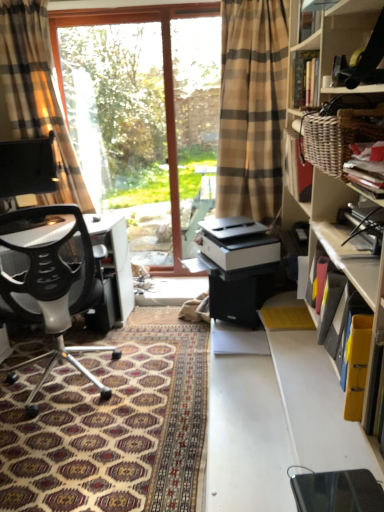
Question: Is matte black book at upper right, the 2th book when ordered from top to bottom, in front of or behind black mesh office chair at left in the image?

Choices:
 (A) front
 (B) behind

Answer: (A)

Question: From the image's perspective, relative to black mesh office chair at left, is matte black book at upper right, the 2th book when ordered from top to bottom, above or below?

Choices:
 (A) below
 (B) above

Answer: (B)

Question: Estimate the real-world distances between objects in this image. Which object is farther from the plaid fabric curtain at left?

Choices:
 (A) transparent glass screen door at center
 (B) patterned carpet at lower left
 (C) yellow plastic folder at right, acting as the 3th book starting from the top
 (D) yellow paper at upper right, which is the third book from bottom to top
 (E) matte black book at upper right, which is counted as the 2th book, starting from the bottom

Answer: (C)

Question: Considering the real-world distances, which object is closest to the plaid fabric curtain at left?

Choices:
 (A) transparent glass screen door at center
 (B) patterned carpet at lower left
 (C) transparent glass window at center
 (D) matte black book at upper right, which is counted as the 2th book, starting from the bottom
 (E) yellow plastic folder at right, which is the 1th book from bottom to top

Answer: (C)